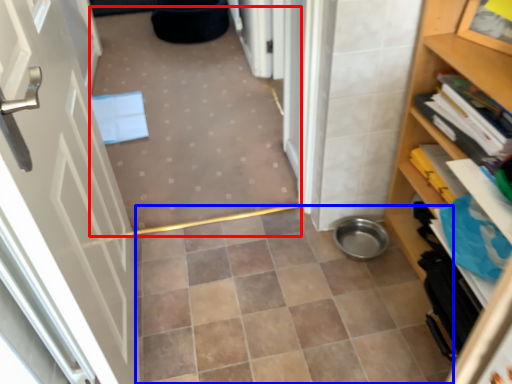
Question: Which point is further to the camera, plain (highlighted by a red box) or ceramic tile (highlighted by a blue box)?

Choices:
 (A) plain
 (B) ceramic tile

Answer: (B)